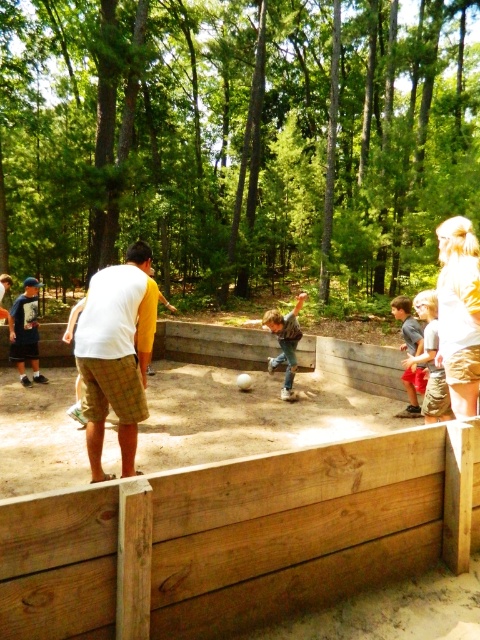
Question: Which of the following is the closest to the observer?

Choices:
 (A) (442, 378)
 (B) (294, 323)

Answer: (A)

Question: Is brown wooden fence at lower center positioned before jeans at center?

Choices:
 (A) no
 (B) yes

Answer: (B)

Question: Does matte blue shirt at left have a greater width compared to jeans at center?

Choices:
 (A) yes
 (B) no

Answer: (A)

Question: Which of the following is the closest to the observer?

Choices:
 (A) (17, 348)
 (B) (442, 392)
 (C) (410, 316)
 (D) (148, 298)

Answer: (D)

Question: In this image, where is gray cotton shirt at center located relative to jeans at center?

Choices:
 (A) below
 (B) above

Answer: (A)

Question: Which of the following is the farthest from the observer?

Choices:
 (A) (14, 317)
 (B) (356, 572)

Answer: (A)